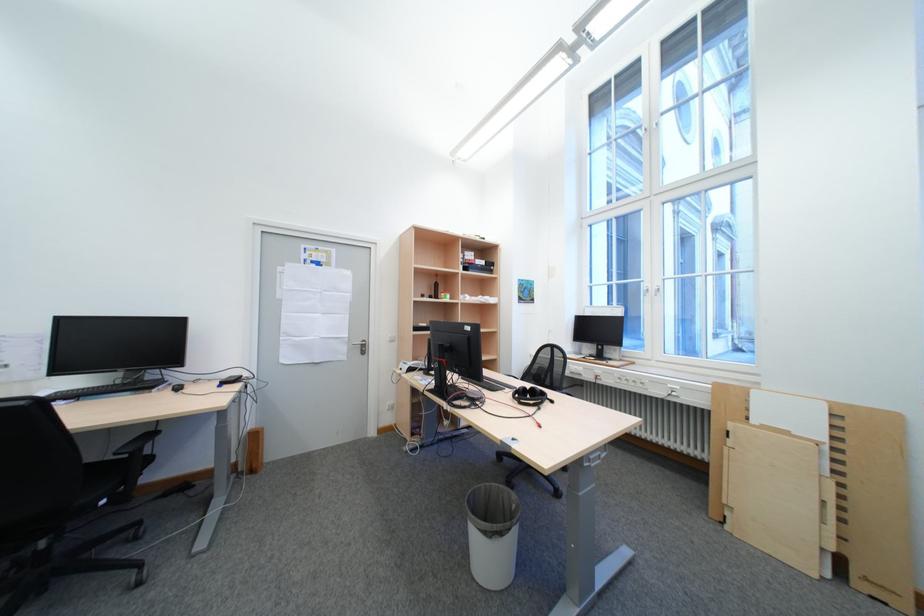
Identify the location of chair sitting surface. (110, 477).